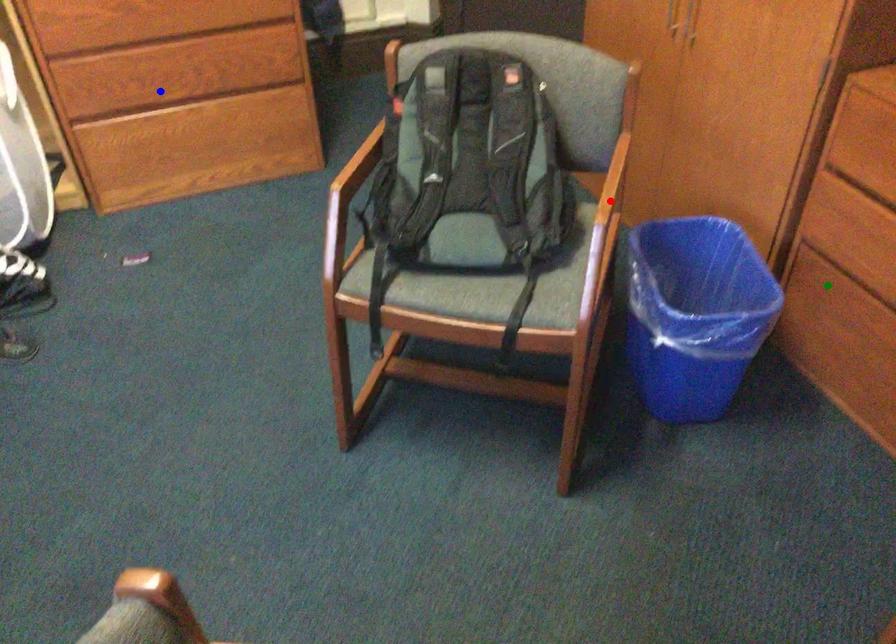
Order these from nearest to farthest:
A) blue point
B) green point
C) red point

1. red point
2. green point
3. blue point